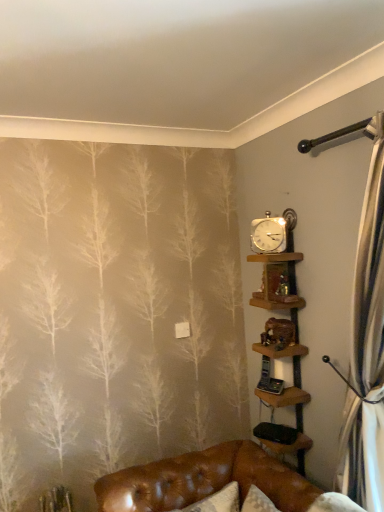
Question: Is wooden shelves at upper right, the 1th shelf in the bottom-to-top sequence, far away from gold metallic clock at upper right?

Choices:
 (A) yes
 (B) no

Answer: (B)

Question: Is wooden shelves at upper right, acting as the 2th shelf starting from the top, closer to camera compared to gold metallic clock at upper right?

Choices:
 (A) yes
 (B) no

Answer: (A)

Question: Can you confirm if wooden shelves at upper right, the 1th shelf in the bottom-to-top sequence, is wider than gold metallic clock at upper right?

Choices:
 (A) no
 (B) yes

Answer: (B)

Question: From the image's perspective, is wooden shelves at upper right, acting as the 2th shelf starting from the top, above gold metallic clock at upper right?

Choices:
 (A) yes
 (B) no

Answer: (B)

Question: Is wooden shelves at upper right, acting as the 2th shelf starting from the top, thinner than gold metallic clock at upper right?

Choices:
 (A) no
 (B) yes

Answer: (A)

Question: From a real-world perspective, does wooden shelves at upper right, acting as the 2th shelf starting from the top, sit lower than gold metallic clock at upper right?

Choices:
 (A) yes
 (B) no

Answer: (A)

Question: Is wooden shelf at upper center, marked as the 2th shelf in a bottom-to-top arrangement, to the left of gold metallic clock at upper right from the viewer's perspective?

Choices:
 (A) no
 (B) yes

Answer: (A)

Question: Can you confirm if wooden shelf at upper center, marked as the 2th shelf in a bottom-to-top arrangement, is smaller than gold metallic clock at upper right?

Choices:
 (A) no
 (B) yes

Answer: (A)

Question: Is wooden shelf at upper center, which appears as the 1th shelf when viewed from the top, behind gold metallic clock at upper right?

Choices:
 (A) no
 (B) yes

Answer: (A)

Question: Is wooden shelf at upper center, which appears as the 1th shelf when viewed from the top, wider than gold metallic clock at upper right?

Choices:
 (A) no
 (B) yes

Answer: (B)

Question: From a real-world perspective, is wooden shelf at upper center, marked as the 2th shelf in a bottom-to-top arrangement, physically above gold metallic clock at upper right?

Choices:
 (A) yes
 (B) no

Answer: (B)

Question: Is the depth of wooden shelf at upper center, marked as the 2th shelf in a bottom-to-top arrangement, less than that of gold metallic clock at upper right?

Choices:
 (A) yes
 (B) no

Answer: (A)

Question: Is gold metallic clock at upper right taller than wooden shelves at upper right, the 1th shelf in the bottom-to-top sequence?

Choices:
 (A) no
 (B) yes

Answer: (A)